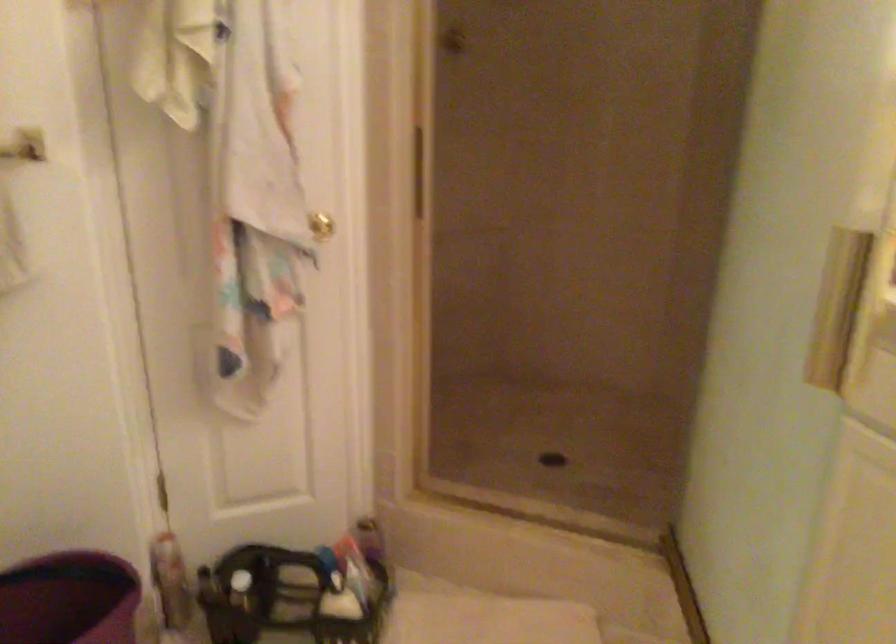
Describe the element at coordinates (165, 545) in the screenshot. I see `a white bottle pump` at that location.